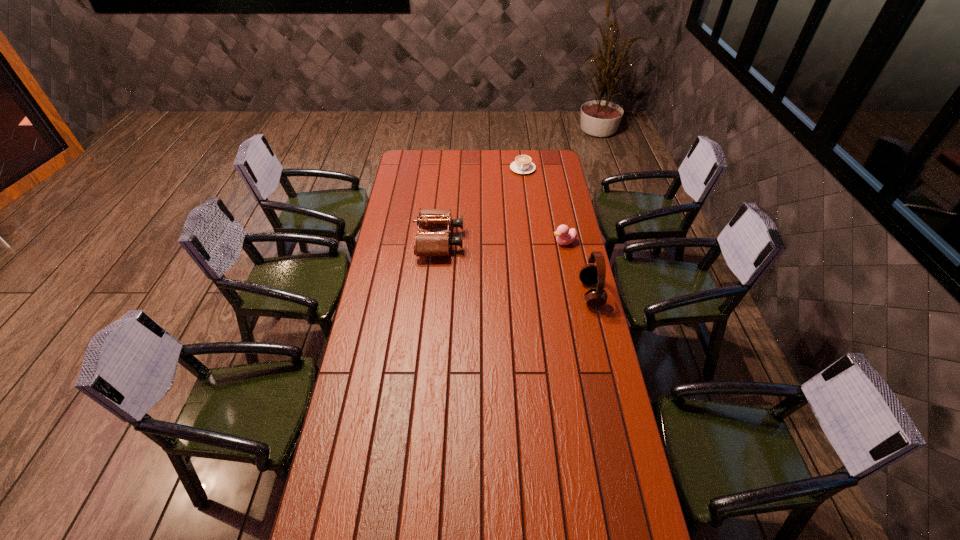
The image size is (960, 540). What are the coordinates of `cappuccino present at the right edge` in the screenshot? It's located at (522, 164).

This screenshot has width=960, height=540. I want to click on duckling that is at the right edge, so click(x=564, y=236).

Locate an element on the screen. The height and width of the screenshot is (540, 960). object that is at the far right corner is located at coordinates (522, 164).

I want to click on vacant space at the far edge, so click(x=445, y=150).

At what (x,y) coordinates should I click in order to perform the action: click on vacant region at the left edge. Please return your answer as a coordinate pair (x, y). The width and height of the screenshot is (960, 540). Looking at the image, I should click on (378, 367).

In the image, there is a desktop. At what (x,y) coordinates should I click in order to perform the action: click on vacant space at the right edge. Please return your answer as a coordinate pair (x, y). The height and width of the screenshot is (540, 960). Looking at the image, I should click on (553, 269).

Image resolution: width=960 pixels, height=540 pixels. In order to click on vacant space at the far left corner in this screenshot , I will do `click(403, 162)`.

The width and height of the screenshot is (960, 540). I want to click on free space at the near left corner of the desktop, so click(x=351, y=508).

You are a GUI agent. You are given a task and a screenshot of the screen. Output one action in this format:
    pyautogui.click(x=<x>, y=<y>)
    Task: Click on the vacant space at the near right corner
    The width and height of the screenshot is (960, 540).
    Given the screenshot: What is the action you would take?
    pyautogui.click(x=638, y=502)

In order to click on vacant space in between the binoculars and the tallest object in this screenshot , I will do `click(516, 267)`.